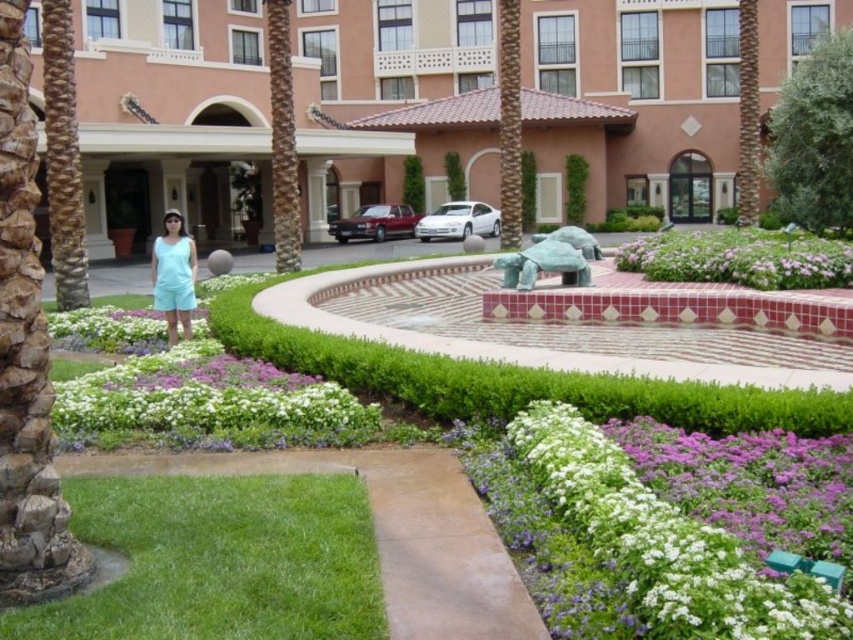
Based on the photo, you are a visitor approaching the building and see the brown textured palm tree at left and the light blue fabric shorts at center. Which object is located to the right of the other?

The brown textured palm tree at left is positioned on the right side of light blue fabric shorts at center, so the palm tree is to the right of the shorts.

You are standing at the entrance of the building and want to take a photo of both the point at coordinates point (59, 300) and point (277, 179). Which point should you focus on first to ensure both are in clear view?

You should focus on point (59, 300) first because it is closer to the camera than point (277, 179), ensuring both points are in focus.

You are standing at the entrance of the building and want to walk to the point marked by point [740,259]. According to the scene description, where exactly is this point located?

Result: The point [740,259] is located on the purple matte flowers at center.